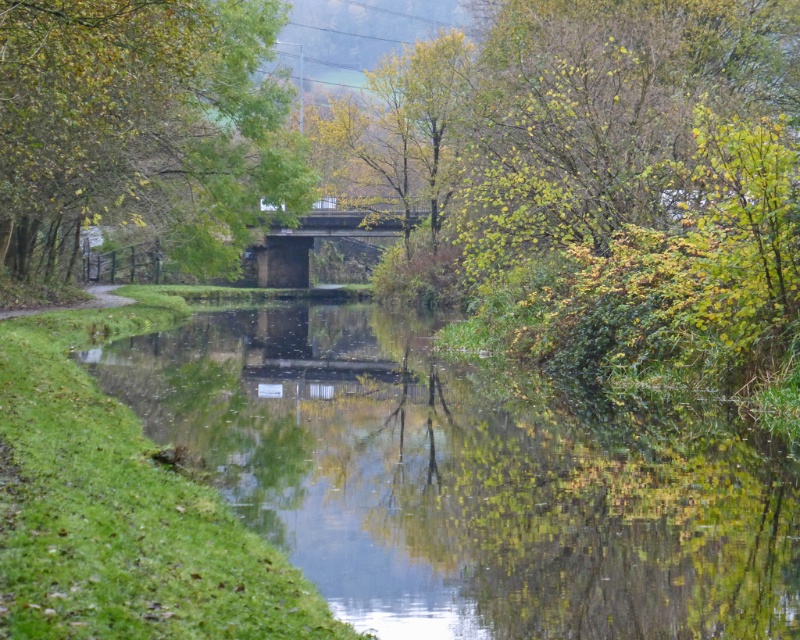
Which of these two, clear water at center or green leafy tree at center, stands shorter?

clear water at center is shorter.

Based on the photo, who is more forward, (x=494, y=467) or (x=188, y=182)?

Positioned in front is point (x=494, y=467).

Where is `clear water at center`? The width and height of the screenshot is (800, 640). clear water at center is located at coordinates (468, 481).

Is clear water at center shorter than concrete bridge at center?

Indeed, clear water at center has a lesser height compared to concrete bridge at center.

Can you confirm if clear water at center is bigger than concrete bridge at center?

No.

You are a GUI agent. You are given a task and a screenshot of the screen. Output one action in this format:
    pyautogui.click(x=<x>, y=<y>)
    Task: Click on the clear water at center
    The width and height of the screenshot is (800, 640).
    Given the screenshot: What is the action you would take?
    pyautogui.click(x=468, y=481)

You are a GUI agent. You are given a task and a screenshot of the screen. Output one action in this format:
    pyautogui.click(x=<x>, y=<y>)
    Task: Click on the clear water at center
    This screenshot has width=800, height=640.
    Given the screenshot: What is the action you would take?
    pyautogui.click(x=468, y=481)

In the scene shown: Which is more to the right, green leafy tree at center or concrete bridge at center?

Positioned to the right is concrete bridge at center.

Can you confirm if green leafy tree at center is smaller than concrete bridge at center?

Incorrect, green leafy tree at center is not smaller in size than concrete bridge at center.

Which is in front, point (32, 108) or point (300, 268)?

Positioned in front is point (32, 108).

What are the coordinates of `green leafy tree at center` in the screenshot? It's located at (140, 125).